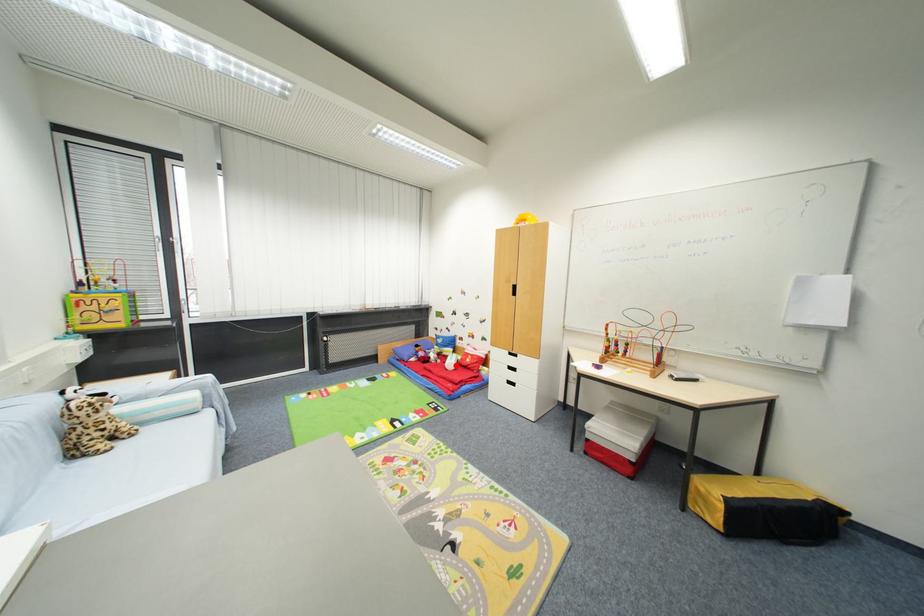
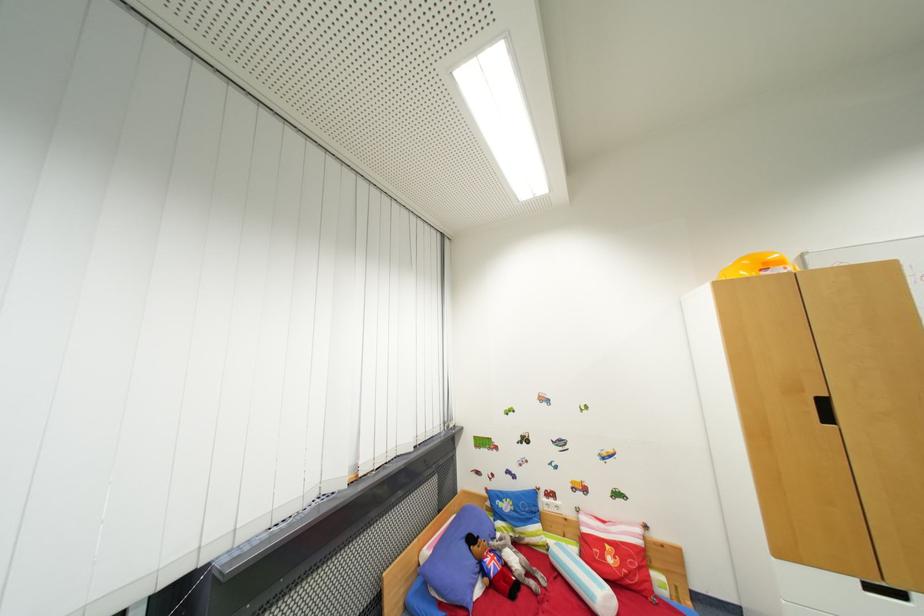
In the second image, find the point that corresponds to the highlighted location in the first image.

(605, 596)